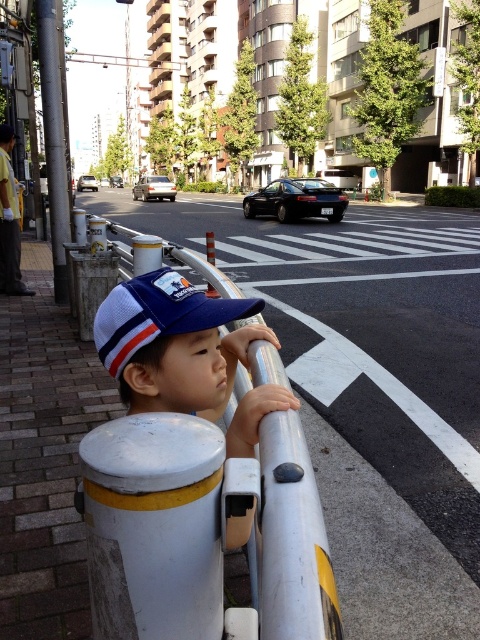
You are a photographer standing at the edge of the sidewalk in the urban street scene. You want to take a photo that includes both the young child leaning on the metallic guardrail and the crosswalk in the midground. Which of the two points, point [186,284] or point [7,220], is closer to your camera position?

Point [186,284] is closer to the camera than point [7,220].

You are a pedestrian trying to cross the street safely. You see the white metallic rail at center and the yellow reflective vest at left. Which object is nearer to you as you stand at the crosswalk?

The white metallic rail at center is closer to the viewer than the yellow reflective vest at left, so the white metallic rail at center is nearer to you.